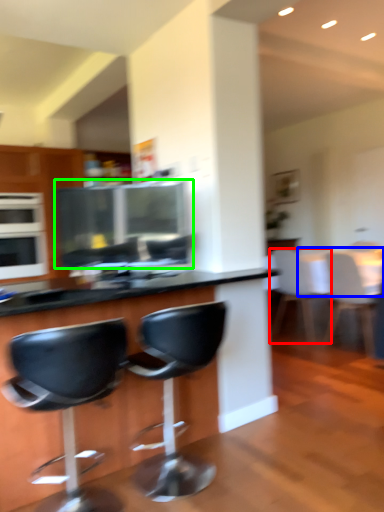
Question: Which is farther away from chair (highlighted by a red box)? table (highlighted by a blue box) or appliance (highlighted by a green box)?

Choices:
 (A) table
 (B) appliance

Answer: (B)